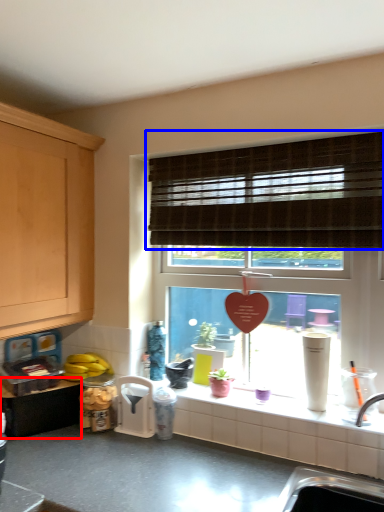
Question: Which point is further to the camera, cabinetry (highlighted by a red box) or window blind (highlighted by a blue box)?

Choices:
 (A) cabinetry
 (B) window blind

Answer: (A)